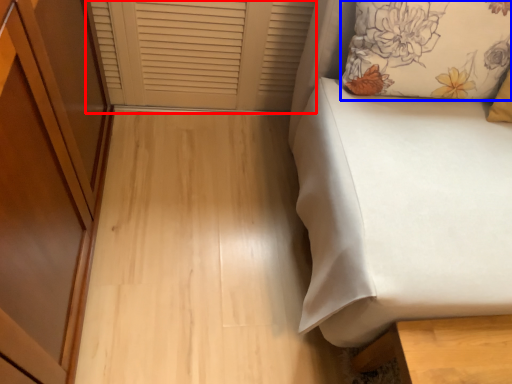
Question: Which point is further to the camera, window frame (highlighted by a red box) or pillow (highlighted by a blue box)?

Choices:
 (A) window frame
 (B) pillow

Answer: (A)